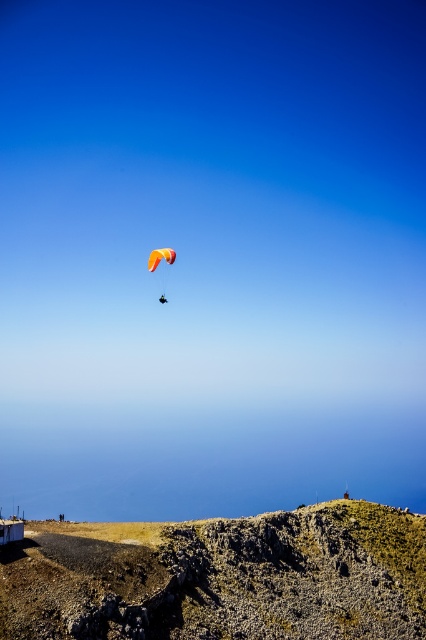
Question: Which point is closer to the camera taking this photo?

Choices:
 (A) (158, 262)
 (B) (247, 564)

Answer: (B)

Question: Where is rugged stone hillside at lower center located in relation to orange fabric parachute at center in the image?

Choices:
 (A) above
 (B) below

Answer: (B)

Question: Can you confirm if rugged stone hillside at lower center is positioned to the right of orange fabric parachute at center?

Choices:
 (A) yes
 (B) no

Answer: (A)

Question: Does rugged stone hillside at lower center appear on the right side of orange fabric parachute at center?

Choices:
 (A) no
 (B) yes

Answer: (B)

Question: Which of the following is the farthest from the observer?

Choices:
 (A) orange fabric parachute at center
 (B) rugged stone hillside at lower center

Answer: (A)